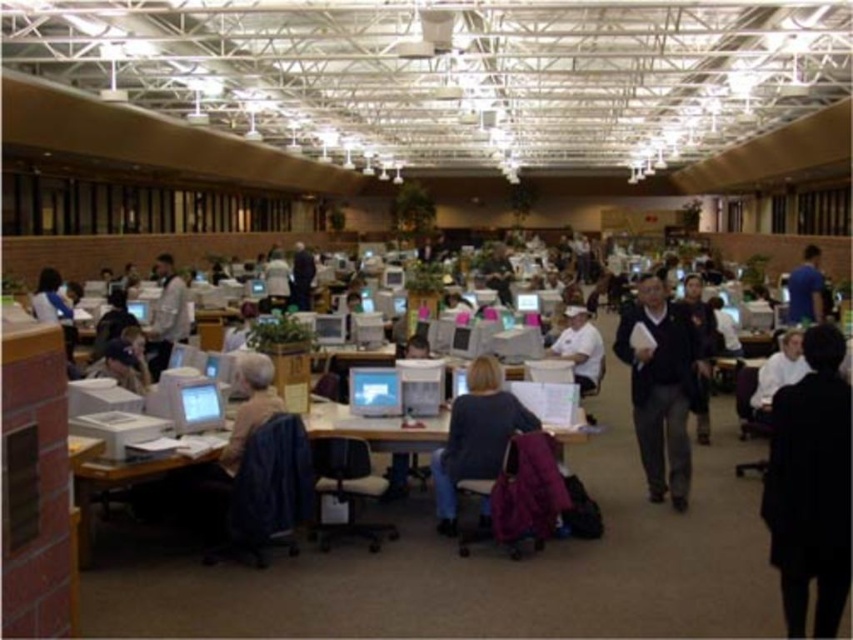
Question: Can you confirm if blue denim jeans at center is positioned above matte gray computer at center?

Choices:
 (A) yes
 (B) no

Answer: (A)

Question: Which of the following is the closest to the observer?

Choices:
 (A) black fabric coat at lower right
 (B) blue fabric shirt at right

Answer: (A)

Question: Which point is closer to the camera?

Choices:
 (A) matte gray computer at center
 (B) blue fabric shirt at right
 (C) matte blue shirt at center

Answer: (C)

Question: Considering the relative positions of matte blue shirt at center and white matte shirt at center in the image provided, where is matte blue shirt at center located with respect to white matte shirt at center?

Choices:
 (A) left
 (B) right

Answer: (B)

Question: Is dark gray sweater at center further to camera compared to blue fabric shirt at right?

Choices:
 (A) yes
 (B) no

Answer: (B)

Question: Estimate the real-world distances between objects in this image. Which object is closer to the dark gray sweater at center?

Choices:
 (A) dark blue shirt at center
 (B) white shirt at center
 (C) white matte shirt at center

Answer: (B)